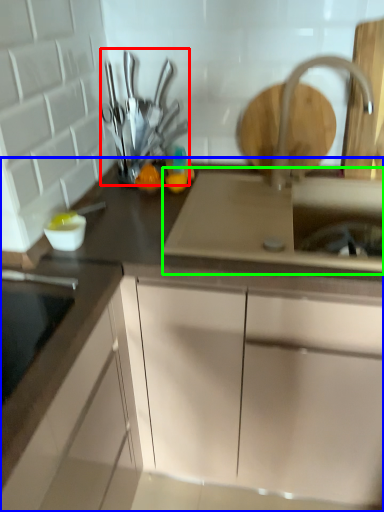
Question: Considering the real-world distances, which object is closest to tableware (highlighted by a red box)? cabinetry (highlighted by a blue box) or sink (highlighted by a green box).

Choices:
 (A) cabinetry
 (B) sink

Answer: (B)